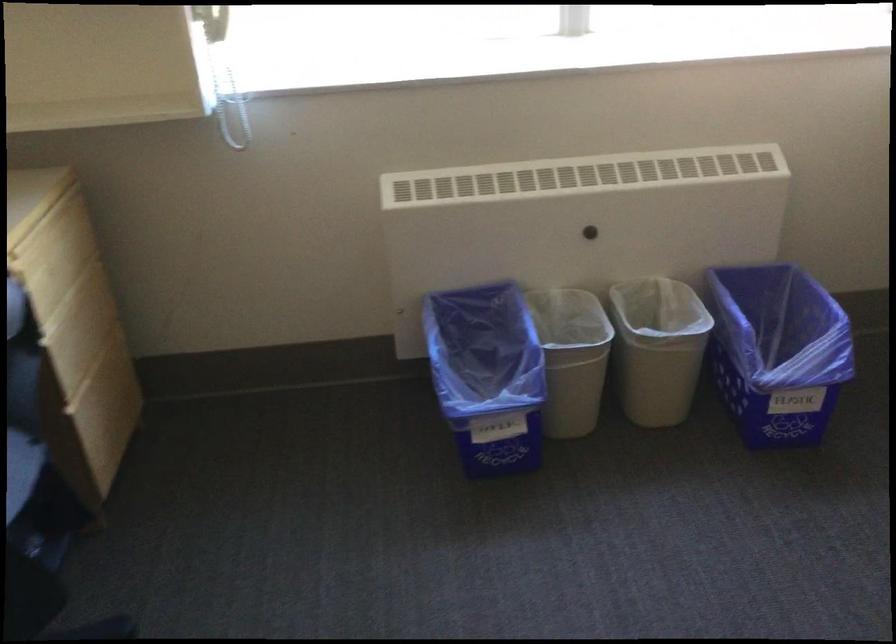
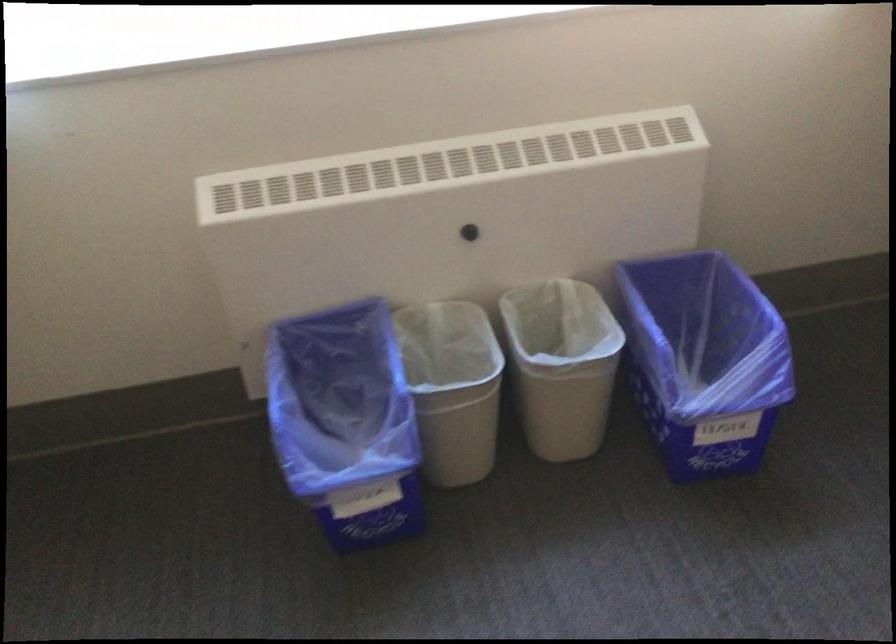
The images are taken continuously from a first-person perspective. In which direction are you moving?

The movement direction of the cameraman is right, forward.